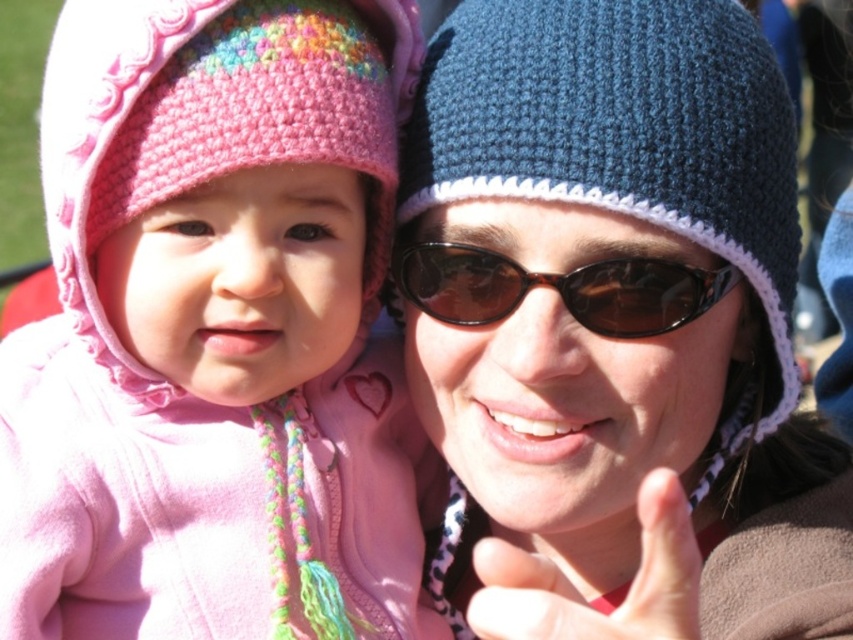
Is matte pink knit hat at left shorter than tortoiseshell sunglasses at center?

No.

This screenshot has width=853, height=640. What do you see at coordinates (215, 333) in the screenshot?
I see `matte pink knit hat at left` at bounding box center [215, 333].

The height and width of the screenshot is (640, 853). In order to click on matte pink knit hat at left in this screenshot , I will do `click(215, 333)`.

Does knitted blue hat at center have a smaller size compared to tortoiseshell sunglasses at center?

No.

Between point (744, 353) and point (480, 301), which one is positioned in front?

Point (480, 301) is in front.

Locate an element on the screen. The image size is (853, 640). knitted blue hat at center is located at coordinates (618, 323).

Who is taller, matte pink knit hat at left or knitted blue hat at center?

Standing taller between the two is knitted blue hat at center.

What do you see at coordinates (215, 333) in the screenshot? The height and width of the screenshot is (640, 853). I see `matte pink knit hat at left` at bounding box center [215, 333].

At what (x,y) coordinates should I click in order to perform the action: click on matte pink knit hat at left. Please return your answer as a coordinate pair (x, y). This screenshot has height=640, width=853. Looking at the image, I should click on (215, 333).